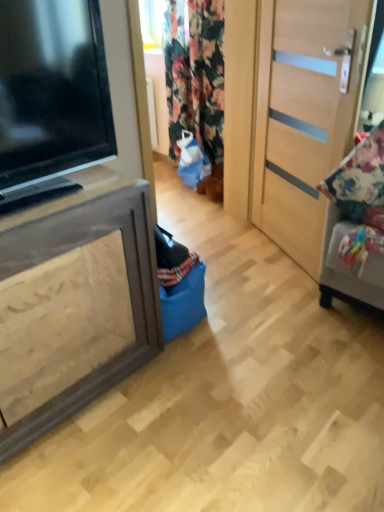
Question: Should I look upward or downward to see black glossy television at left?

Choices:
 (A) up
 (B) down

Answer: (A)

Question: Is floral fabric curtain at center to the right of floral fabric cushion at right from the viewer's perspective?

Choices:
 (A) yes
 (B) no

Answer: (B)

Question: Considering the relative sizes of floral fabric curtain at center and floral fabric cushion at right in the image provided, is floral fabric curtain at center thinner than floral fabric cushion at right?

Choices:
 (A) yes
 (B) no

Answer: (A)

Question: Is floral fabric curtain at center bigger than floral fabric cushion at right?

Choices:
 (A) no
 (B) yes

Answer: (B)

Question: Is the position of floral fabric curtain at center less distant than that of floral fabric cushion at right?

Choices:
 (A) yes
 (B) no

Answer: (B)

Question: Is floral fabric curtain at center to the left of floral fabric cushion at right from the viewer's perspective?

Choices:
 (A) yes
 (B) no

Answer: (A)

Question: Is floral fabric curtain at center wider than floral fabric cushion at right?

Choices:
 (A) no
 (B) yes

Answer: (A)

Question: Does light wood door at right appear on the right side of floral fabric cushion at right?

Choices:
 (A) no
 (B) yes

Answer: (A)

Question: Could you tell me if light wood door at right is facing floral fabric cushion at right?

Choices:
 (A) no
 (B) yes

Answer: (A)

Question: Is light wood door at right positioned in front of floral fabric cushion at right?

Choices:
 (A) no
 (B) yes

Answer: (A)

Question: From a real-world perspective, is light wood door at right over floral fabric cushion at right?

Choices:
 (A) yes
 (B) no

Answer: (B)

Question: Considering the relative sizes of light wood door at right and floral fabric cushion at right in the image provided, is light wood door at right bigger than floral fabric cushion at right?

Choices:
 (A) no
 (B) yes

Answer: (B)

Question: Considering the relative positions of light wood door at right and floral fabric cushion at right in the image provided, is light wood door at right to the left of floral fabric cushion at right from the viewer's perspective?

Choices:
 (A) yes
 (B) no

Answer: (A)

Question: Is brown wood cabinet at left outside of light wood door at right?

Choices:
 (A) no
 (B) yes

Answer: (B)